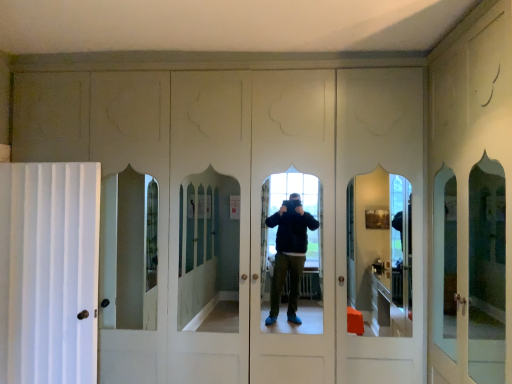
Question: Considering the relative sizes of white matte screen door at right and white fabric curtain at left in the image provided, is white matte screen door at right bigger than white fabric curtain at left?

Choices:
 (A) yes
 (B) no

Answer: (A)

Question: Would you say white matte screen door at right is outside white fabric curtain at left?

Choices:
 (A) yes
 (B) no

Answer: (A)

Question: Could you tell me if white matte screen door at right is turned towards white fabric curtain at left?

Choices:
 (A) yes
 (B) no

Answer: (A)

Question: Is white matte screen door at right taller than white fabric curtain at left?

Choices:
 (A) no
 (B) yes

Answer: (B)

Question: Does white matte screen door at right have a smaller size compared to white fabric curtain at left?

Choices:
 (A) yes
 (B) no

Answer: (B)

Question: Considering the relative sizes of white matte screen door at right and white fabric curtain at left in the image provided, is white matte screen door at right shorter than white fabric curtain at left?

Choices:
 (A) no
 (B) yes

Answer: (A)

Question: Can we say white fabric curtain at left lies outside white matte screen door at right?

Choices:
 (A) yes
 (B) no

Answer: (A)

Question: Are white fabric curtain at left and white matte screen door at right far apart?

Choices:
 (A) yes
 (B) no

Answer: (A)

Question: Is white fabric curtain at left aimed at white matte screen door at right?

Choices:
 (A) yes
 (B) no

Answer: (B)

Question: From the image's perspective, is white fabric curtain at left under white matte screen door at right?

Choices:
 (A) no
 (B) yes

Answer: (B)

Question: Is the depth of white fabric curtain at left less than that of white matte screen door at right?

Choices:
 (A) no
 (B) yes

Answer: (A)

Question: From the image's perspective, is white fabric curtain at left on white matte screen door at right?

Choices:
 (A) no
 (B) yes

Answer: (A)

Question: Considering the positions of point (455, 302) and point (10, 233), is point (455, 302) closer or farther from the camera than point (10, 233)?

Choices:
 (A) closer
 (B) farther

Answer: (A)